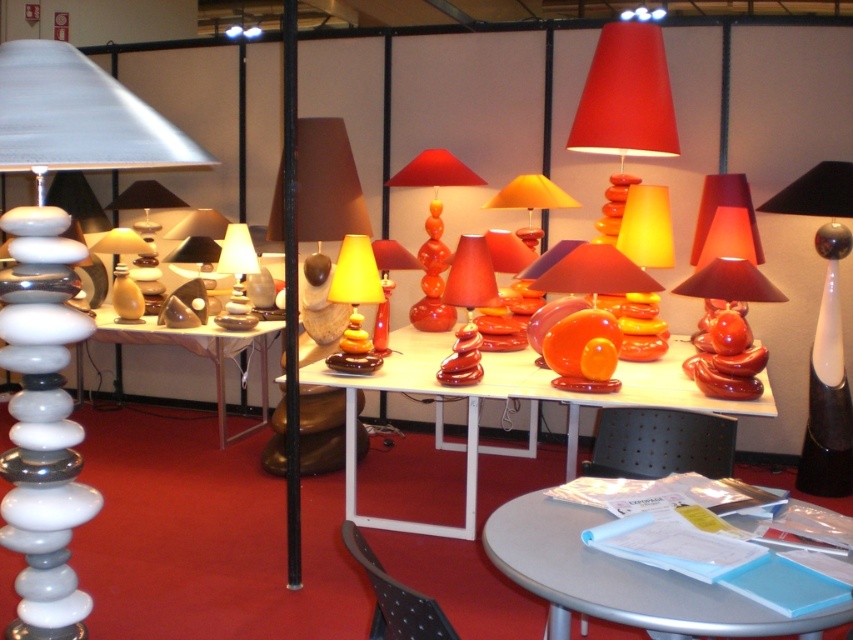
Is metallic gray table at center wider than gray perforated chair at lower center?

Correct, the width of metallic gray table at center exceeds that of gray perforated chair at lower center.

Is metallic gray table at center smaller than gray perforated chair at lower center?

Incorrect, metallic gray table at center is not smaller in size than gray perforated chair at lower center.

Does point (611, 618) lie behind point (636, 412)?

No, (611, 618) is closer to viewer.

Identify the location of metallic gray table at center. (622, 580).

Between gray perforated chair at lower center and black textured chair at lower center, which one is positioned higher?

gray perforated chair at lower center

Is gray perforated chair at lower center to the left of black textured chair at lower center from the viewer's perspective?

Incorrect, gray perforated chair at lower center is not on the left side of black textured chair at lower center.

The width and height of the screenshot is (853, 640). Identify the location of gray perforated chair at lower center. (665, 442).

Between point (712, 250) and point (418, 604), which one is positioned in front?

Positioned in front is point (418, 604).

Based on the photo, is the position of glossy orange glass table lamp at center less distant than that of black textured chair at lower center?

No, it is not.

Does point (705, 188) come closer to viewer compared to point (383, 618)?

No, (705, 188) is behind (383, 618).

At what (x,y) coordinates should I click in order to perform the action: click on glossy orange glass table lamp at center. Please return your answer as a coordinate pair (x, y). This screenshot has height=640, width=853. Looking at the image, I should click on (728, 291).